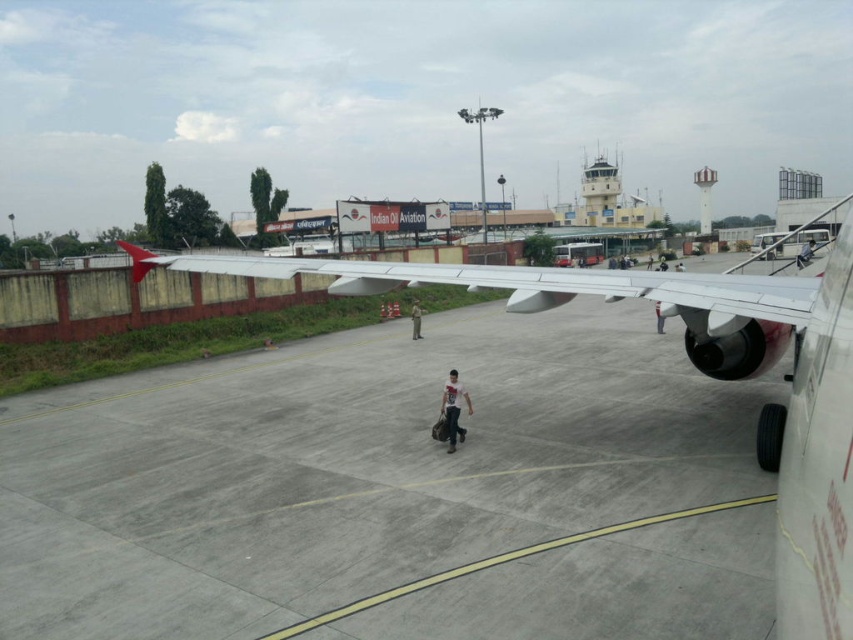
Question: Among these objects, which one is farthest from the camera?

Choices:
 (A) gray fabric pants at center
 (B) polished aluminum wing at center
 (C) matte black jacket at center
 (D) matte black person at center

Answer: (A)

Question: Does gray fabric pants at center lie in front of matte black person at center?

Choices:
 (A) no
 (B) yes

Answer: (A)

Question: Which point appears farthest from the camera in this image?

Choices:
 (A) (421, 336)
 (B) (804, 266)
 (C) (379, 273)

Answer: (A)

Question: Does polished aluminum wing at center appear under matte black jacket at center?

Choices:
 (A) yes
 (B) no

Answer: (B)

Question: Is polished aluminum wing at center to the left of matte black jacket at center from the viewer's perspective?

Choices:
 (A) yes
 (B) no

Answer: (A)

Question: Considering the real-world distances, which object is closest to the polished aluminum wing at center?

Choices:
 (A) white cotton shirt at center
 (B) gray fabric pants at center

Answer: (A)